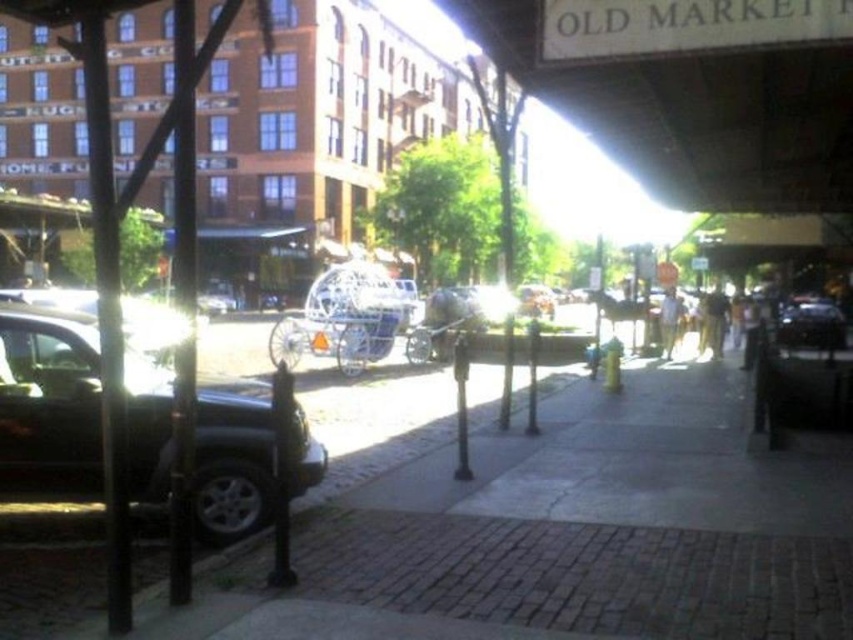
Question: Is wooden signboard at upper center above shiny black car at right?

Choices:
 (A) yes
 (B) no

Answer: (A)

Question: Which of the following is the farthest from the observer?

Choices:
 (A) (41, 474)
 (B) (654, 116)

Answer: (B)

Question: Which of the following is the closest to the observer?

Choices:
 (A) (306, 461)
 (B) (813, 56)
 (C) (788, 348)

Answer: (A)

Question: Is shiny black car at left closer to camera compared to shiny black car at right?

Choices:
 (A) yes
 (B) no

Answer: (A)

Question: Which object is the closest to the wooden signboard at upper center?

Choices:
 (A) shiny black car at left
 (B) shiny black car at right

Answer: (B)

Question: Is wooden signboard at upper center smaller than shiny black car at left?

Choices:
 (A) yes
 (B) no

Answer: (B)